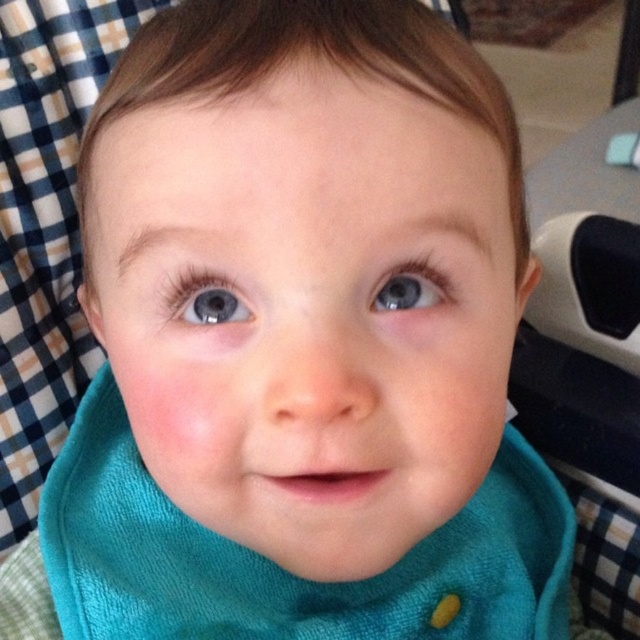
Question: Which of the following is the closest to the observer?

Choices:
 (A) (515, 500)
 (B) (193, 280)
 (C) (412, 301)

Answer: (B)

Question: Can you confirm if teal soft fabric bib at center is positioned to the left of blue glossy eye at center?

Choices:
 (A) no
 (B) yes

Answer: (A)

Question: Among these objects, which one is farthest from the camera?

Choices:
 (A) blue glossy eye at center
 (B) blue glossy eye at upper center
 (C) teal soft fabric bib at center

Answer: (C)

Question: Which object is positioned closest to the blue glossy eye at upper center?

Choices:
 (A) blue glossy eye at center
 (B) teal soft fabric bib at center

Answer: (A)

Question: Is teal soft fabric bib at center in front of blue glossy eye at upper center?

Choices:
 (A) no
 (B) yes

Answer: (A)

Question: Is teal soft fabric bib at center wider than blue glossy eye at center?

Choices:
 (A) yes
 (B) no

Answer: (A)